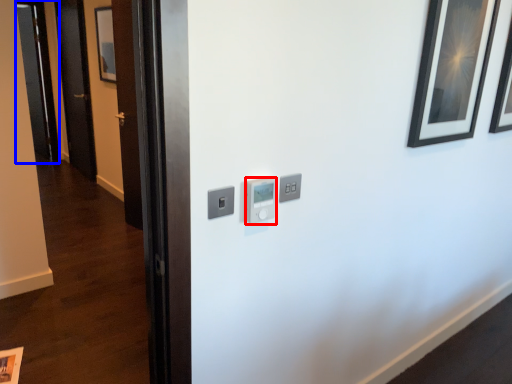
Question: Which object appears farthest to the camera in this image, light switch (highlighted by a red box) or glass door (highlighted by a blue box)?

Choices:
 (A) light switch
 (B) glass door

Answer: (B)